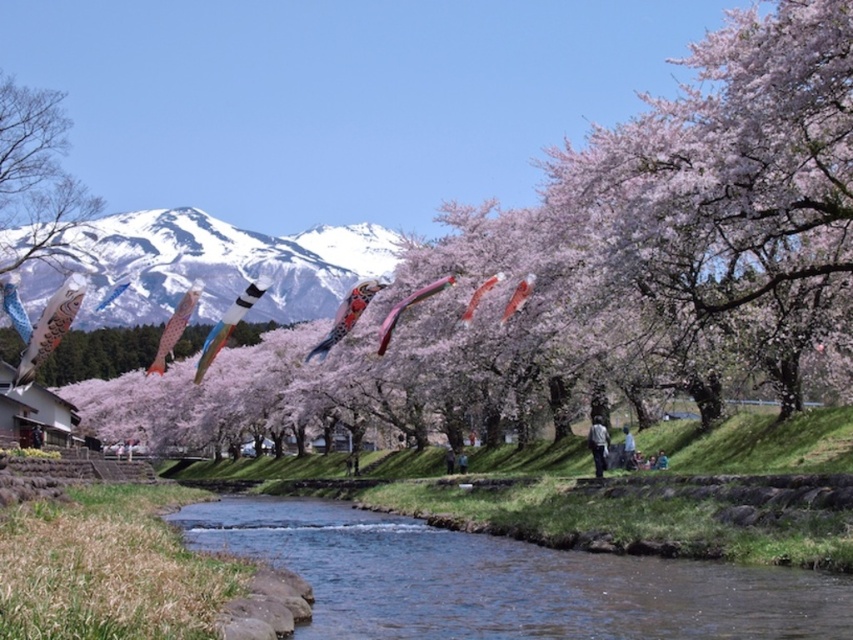
Question: Does snowy white mountain at upper center have a greater width compared to multicolored fabric kite at center?

Choices:
 (A) yes
 (B) no

Answer: (A)

Question: In this image, where is multicolored paper kite at center located relative to pink fabric kite at center?

Choices:
 (A) right
 (B) left

Answer: (B)

Question: Is pink blossoms at center wider than light gray fabric jacket at center?

Choices:
 (A) yes
 (B) no

Answer: (A)

Question: Considering the real-world distances, which object is farthest from the matte pink kite at center?

Choices:
 (A) pink fabric kite at center
 (B) shiny red kite at center
 (C) light gray fabric jacket at center
 (D) pink blossoms at center

Answer: (D)

Question: Which of the following is the closest to the observer?

Choices:
 (A) (602, 442)
 (B) (332, 292)

Answer: (A)

Question: Which object appears closest to the camera in this image?

Choices:
 (A) pink fabric kite at center
 (B) matte pink kite at center-left

Answer: (A)